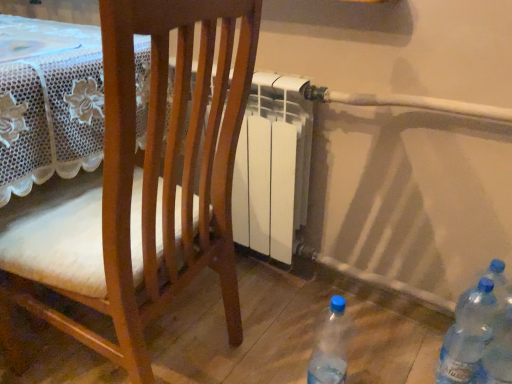
You are a GUI agent. You are given a task and a screenshot of the screen. Output one action in this format:
    pyautogui.click(x=<x>, y=<y>)
    Task: Click on the free spot behind transparent plastic bottles at lower right, placed as the second bottle when sorted from left to right
    
    Given the screenshot: What is the action you would take?
    pyautogui.click(x=410, y=337)